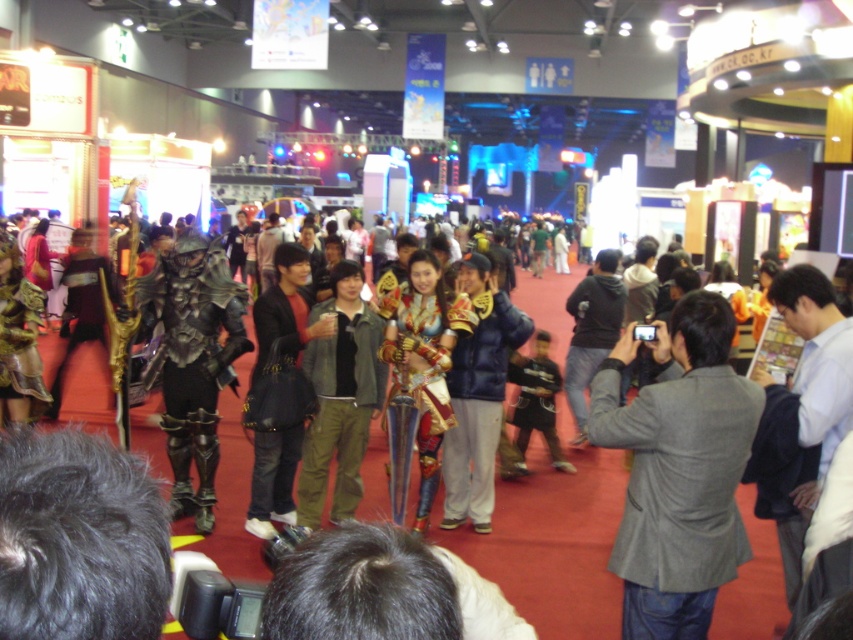
You are an attendee at the event and want to take a photo of both the green matte jacket at center and the gold metallic armor at center. Which one should you focus on first if you want to capture them in order from left to right?

The green matte jacket at center should be focused on first as it is positioned to the left of the gold metallic armor at center.

You are standing in the convention hall and want to move from point A to point B. Point A is at coordinate point (296, 516) and point B is at coordinate point (389, 451). Which point is closer to you when you are facing the scene?

Point A at coordinate point (296, 516) is closer to you because it is further to the viewer than point B at coordinate point (389, 451).